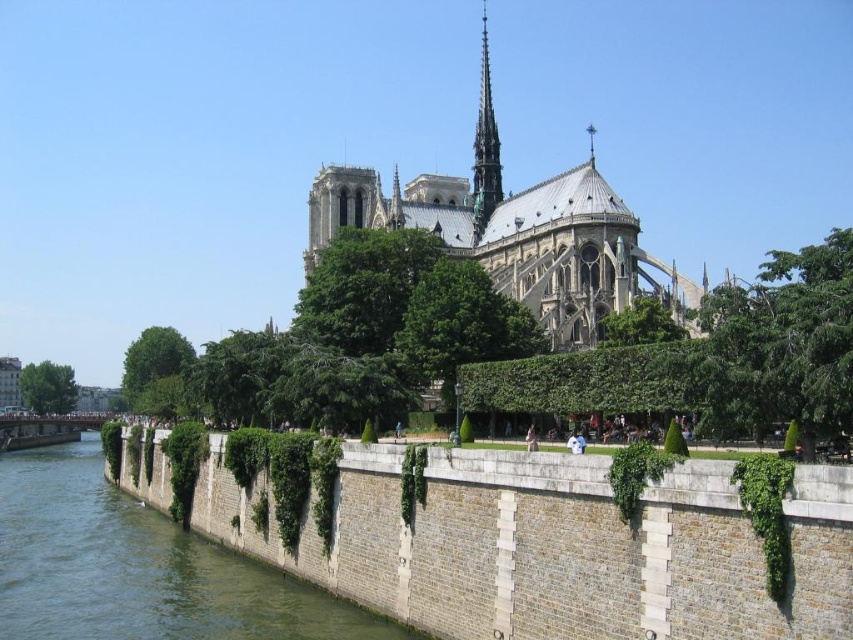
Is point (527, 484) more distant than point (9, 499)?

No, it is not.

You are a GUI agent. You are given a task and a screenshot of the screen. Output one action in this format:
    pyautogui.click(x=<x>, y=<y>)
    Task: Click on the gray stone wall at lower left
    This screenshot has width=853, height=640.
    Given the screenshot: What is the action you would take?
    pyautogui.click(x=552, y=547)

Measure the distance between green leafy tree at center and green leafy tree at lower left.

They are 108.52 meters apart.

What do you see at coordinates (461, 324) in the screenshot? This screenshot has width=853, height=640. I see `green leafy tree at center` at bounding box center [461, 324].

Where is `green leafy tree at center`? This screenshot has height=640, width=853. green leafy tree at center is located at coordinates (461, 324).

Describe the element at coordinates (514, 230) in the screenshot. I see `stone gothic cathedral at center` at that location.

Is stone gothic cathedral at center behind green leafy tree at center?

No, stone gothic cathedral at center is closer to the viewer.

Between point (476, 192) and point (451, 387), which one is positioned in front?

Point (451, 387) is in front.

Find the location of `stone gothic cathedral at center`. stone gothic cathedral at center is located at coordinates (514, 230).